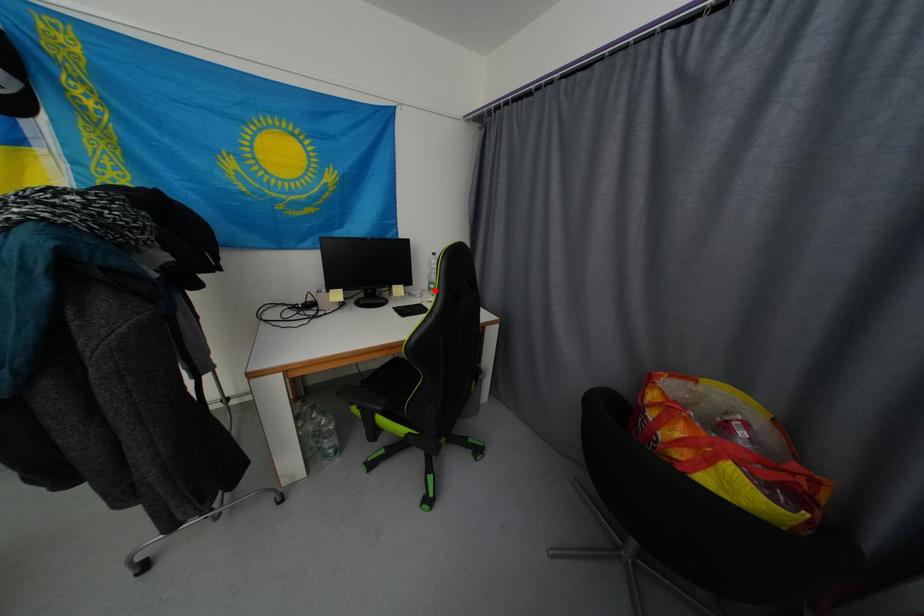
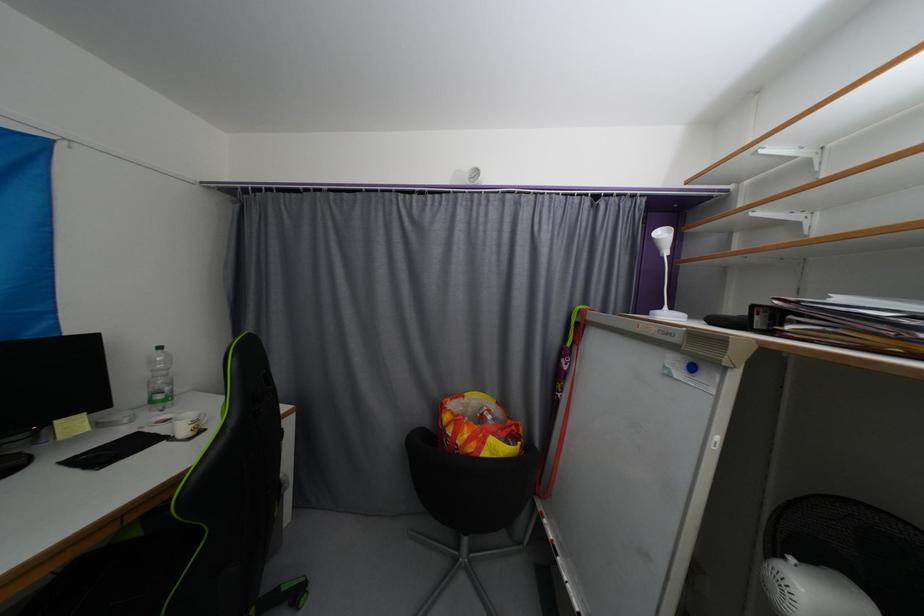
Locate, in the second image, the point that corresponds to the highlighted location in the first image.

(157, 403)